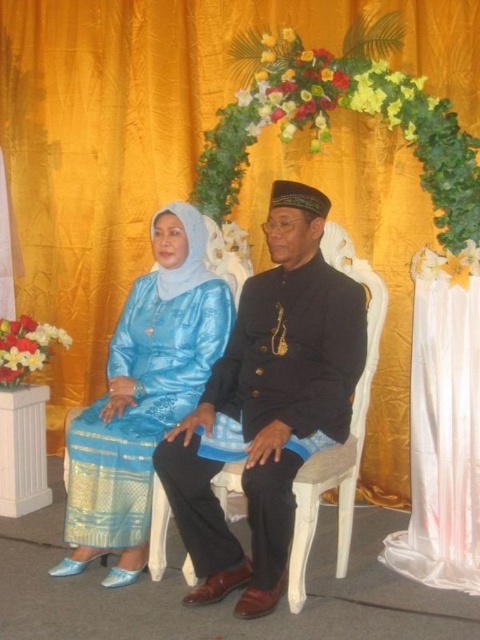
Consider the image. Based on the coordinates provided, which object is located at point (267, 404) in the image?

The point (267, 404) corresponds to the black satin suit at center.

You are a photographer at a formal event. You need to position a camera at point A to capture the black satin suit at center. Where should you aim the camera based on the coordinates provided?

The black satin suit at center is located at coordinates point A at point (267, 404).

In the image, there are two people sitting against a golden curtain. The woman is wearing a satin blue dress at center, and the man is wearing a black traditional outfit. Based on their positions, can you determine which person is seated closer to the left side?

The satin blue dress at center is positioned at point 0.619 on the horizontal axis, indicating the woman wearing it is seated closer to the left side compared to the man in the black traditional outfit.